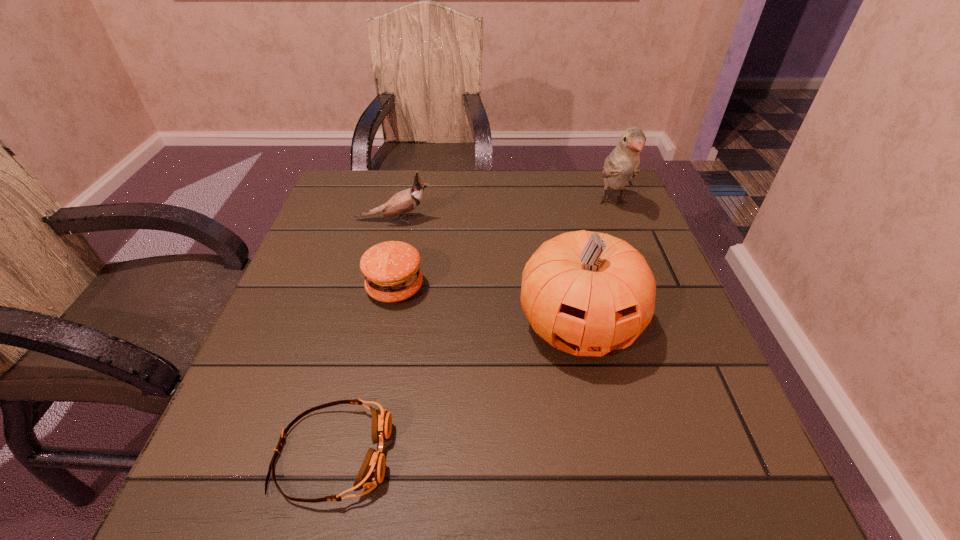
Find the location of `the taller bird`. the taller bird is located at coordinates (623, 163).

Image resolution: width=960 pixels, height=540 pixels. Find the location of `the right bird`. the right bird is located at coordinates (623, 163).

Where is `pumpkin`? pumpkin is located at coordinates (586, 293).

Where is `the third tallest object`? This screenshot has width=960, height=540. the third tallest object is located at coordinates (406, 201).

Where is `the shorter bird`? The image size is (960, 540). the shorter bird is located at coordinates 406,201.

Identify the location of the fourth tallest object. [x=391, y=269].

Find the location of a particular element. Image resolution: width=960 pixels, height=540 pixels. goggles is located at coordinates (371, 473).

Identify the location of the nearest object. The image size is (960, 540). (371, 473).

Locate an element on the screen. This screenshot has height=540, width=960. free region located 0.340m at the face of the rightmost object is located at coordinates (663, 332).

Where is `vacant space positioned 0.140m on the front-facing side of the pumpkin`? This screenshot has width=960, height=540. vacant space positioned 0.140m on the front-facing side of the pumpkin is located at coordinates (606, 456).